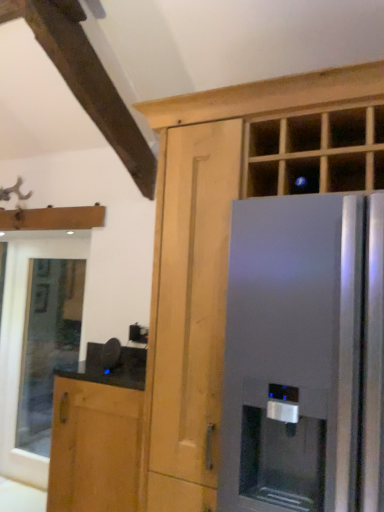
Where is `blank space situated above clear glass window at lower left (from a real-world perspective)`? blank space situated above clear glass window at lower left (from a real-world perspective) is located at coordinates (51, 242).